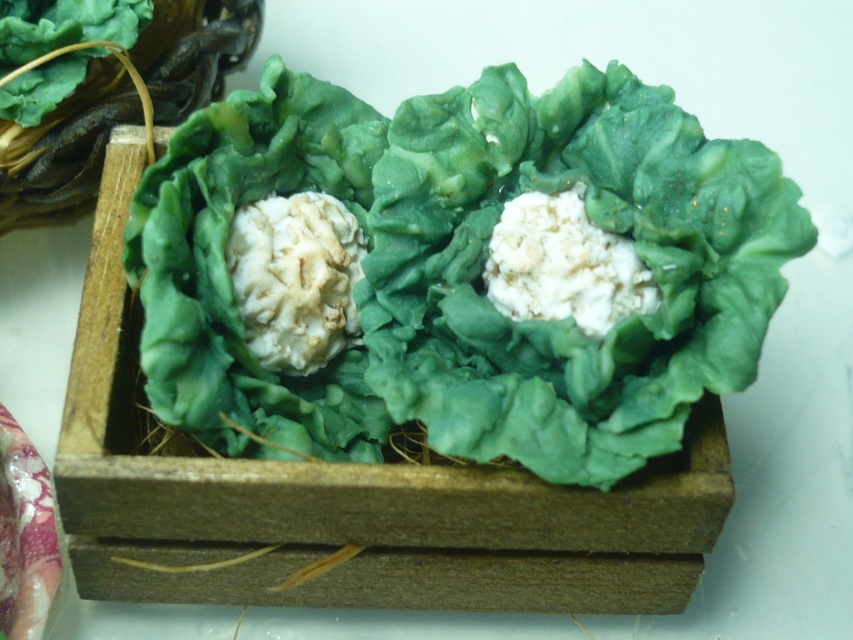
Question: Which object appears farthest from the camera in this image?

Choices:
 (A) green matte lettuce at center
 (B) white crumbly food at center

Answer: (B)

Question: Is green matte lettuce at center to the right of white crumbly food at center from the viewer's perspective?

Choices:
 (A) no
 (B) yes

Answer: (B)

Question: Which point is closer to the camera taking this photo?

Choices:
 (A) click(276, 305)
 (B) click(602, 298)

Answer: (B)

Question: Can you confirm if green matte lettuce at center is smaller than white crumbly food at center?

Choices:
 (A) yes
 (B) no

Answer: (B)

Question: Is green matte lettuce at center below white crumbly food at center?

Choices:
 (A) no
 (B) yes

Answer: (A)